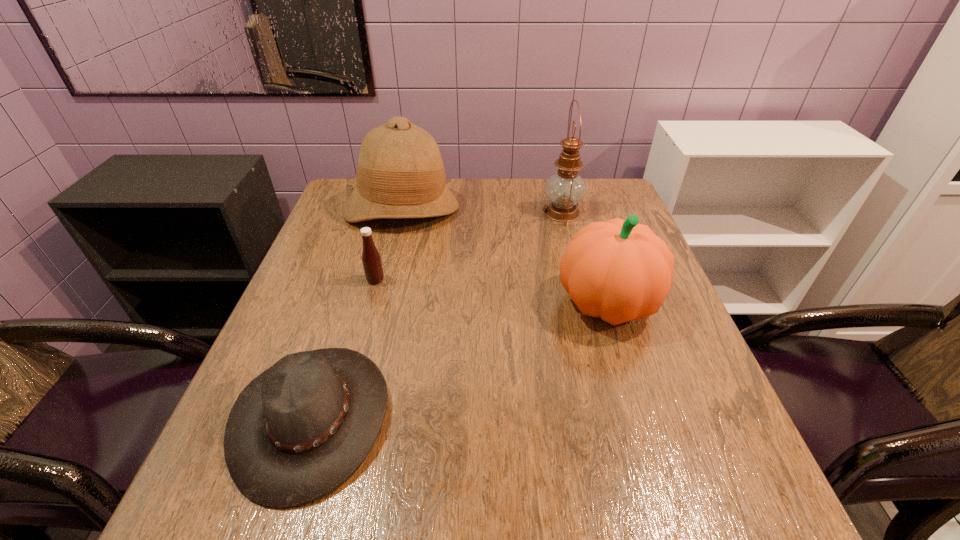
In order to click on blank area at the near edge in this screenshot , I will do `click(559, 517)`.

Image resolution: width=960 pixels, height=540 pixels. In the image, there is a desktop. In order to click on vacant space at the left edge in this screenshot , I will do `click(342, 223)`.

The height and width of the screenshot is (540, 960). I want to click on blank space at the right edge, so click(x=655, y=420).

Where is `vacant space at the far right corner`? The width and height of the screenshot is (960, 540). vacant space at the far right corner is located at coordinates (606, 204).

Where is `vacant space that's between the taller hat and the Tabasco sauce`? vacant space that's between the taller hat and the Tabasco sauce is located at coordinates click(x=389, y=244).

The image size is (960, 540). Find the location of `free spot between the farther hat and the oil lamp`. free spot between the farther hat and the oil lamp is located at coordinates (482, 210).

Find the location of a particular element. The height and width of the screenshot is (540, 960). free space between the farther hat and the oil lamp is located at coordinates (482, 210).

At what (x,y) coordinates should I click in order to perform the action: click on empty space that is in between the taller hat and the oil lamp. Please return your answer as a coordinate pair (x, y). This screenshot has height=540, width=960. Looking at the image, I should click on pos(482,210).

Locate an element on the screen. The width and height of the screenshot is (960, 540). unoccupied position between the taller hat and the pumpkin is located at coordinates (504, 255).

Locate an element on the screen. Image resolution: width=960 pixels, height=540 pixels. unoccupied area between the taller hat and the second shortest object is located at coordinates (389, 244).